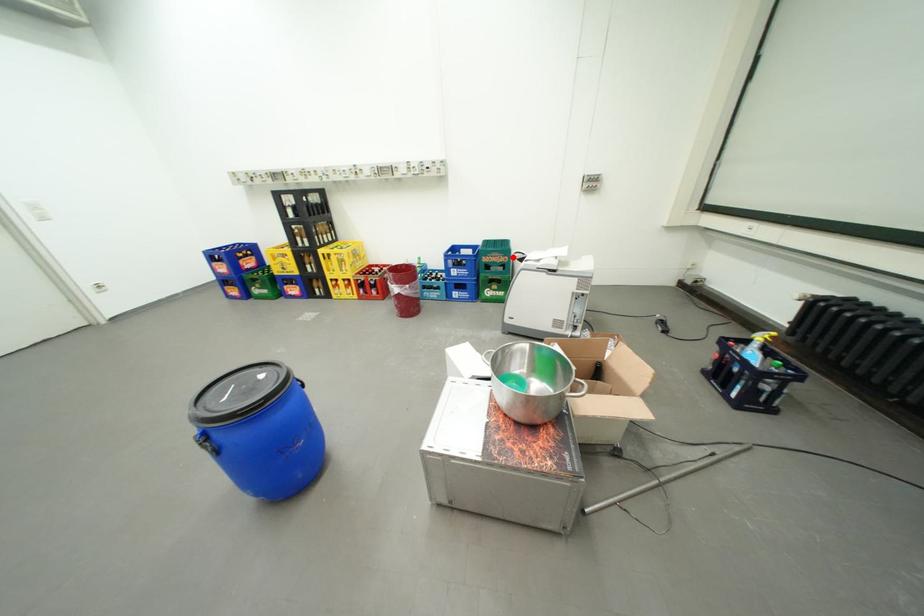
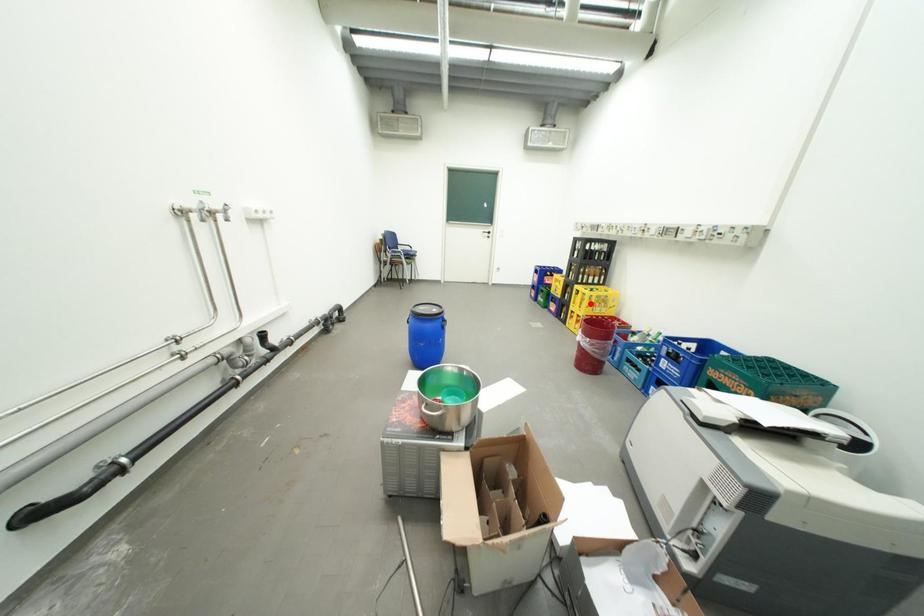
I am providing you with two images of the same scene from different viewpoints. A red point is marked on the first image and another point is marked on the second image. Are the points marked in image1 and image2 representing the same 3D position?

No